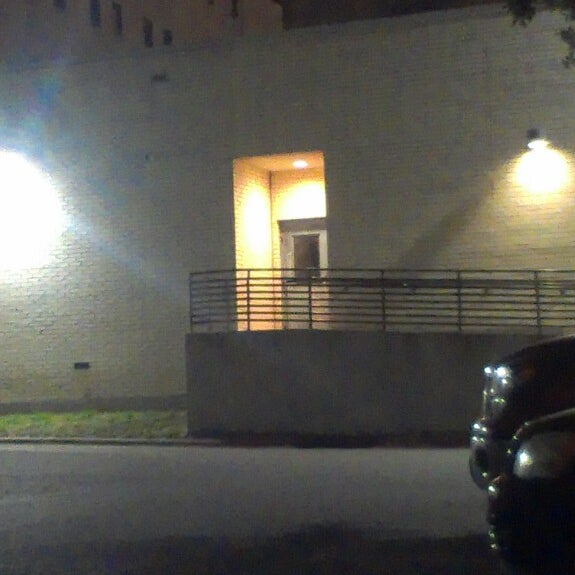
Where is `lighting`? The width and height of the screenshot is (575, 575). lighting is located at coordinates (20, 214), (535, 143), (299, 162).